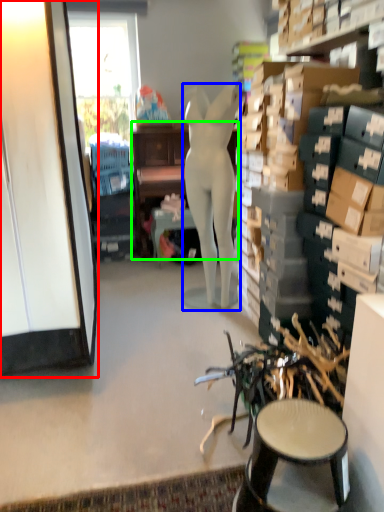
Question: Which is nearer to the cabinetry (highlighted by a red box)? person (highlighted by a blue box) or desk (highlighted by a green box).

Choices:
 (A) person
 (B) desk

Answer: (A)